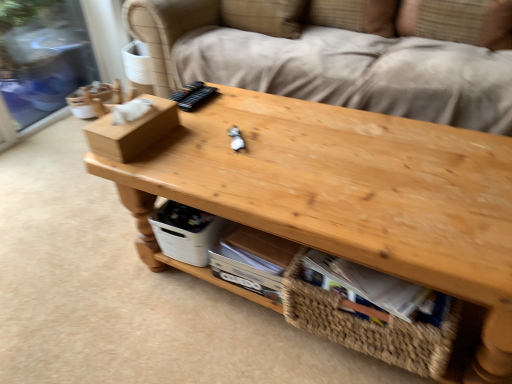
Question: Is natural wood table at center oriented away from brown cardboard box at left?

Choices:
 (A) no
 (B) yes

Answer: (A)

Question: From a real-world perspective, is natural wood table at center on top of brown cardboard box at left?

Choices:
 (A) yes
 (B) no

Answer: (B)

Question: From a real-world perspective, is natural wood table at center below brown cardboard box at left?

Choices:
 (A) yes
 (B) no

Answer: (A)

Question: Is natural wood table at center aimed at brown cardboard box at left?

Choices:
 (A) yes
 (B) no

Answer: (B)

Question: Are natural wood table at center and brown cardboard box at left far apart?

Choices:
 (A) no
 (B) yes

Answer: (A)

Question: Is the depth of natural wood table at center less than that of brown cardboard box at left?

Choices:
 (A) yes
 (B) no

Answer: (A)

Question: Does brown cardboard box at left turn towards woven straw basket at lower center?

Choices:
 (A) no
 (B) yes

Answer: (A)

Question: Can you confirm if brown cardboard box at left is thinner than woven straw basket at lower center?

Choices:
 (A) no
 (B) yes

Answer: (A)

Question: Is brown cardboard box at left behind woven straw basket at lower center?

Choices:
 (A) no
 (B) yes

Answer: (B)

Question: From the image's perspective, does brown cardboard box at left appear higher than woven straw basket at lower center?

Choices:
 (A) no
 (B) yes

Answer: (B)

Question: Does brown cardboard box at left have a smaller size compared to woven straw basket at lower center?

Choices:
 (A) no
 (B) yes

Answer: (B)

Question: Is brown cardboard box at left at the right side of woven straw basket at lower center?

Choices:
 (A) yes
 (B) no

Answer: (B)

Question: Does white plastic storage box at lower center have a lesser width compared to brown cardboard box at left?

Choices:
 (A) yes
 (B) no

Answer: (A)